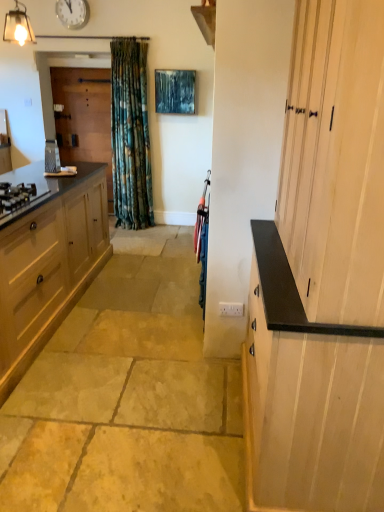
Where is `free space above natural stone floor at center (from a real-world perspective)`? free space above natural stone floor at center (from a real-world perspective) is located at coordinates (133, 309).